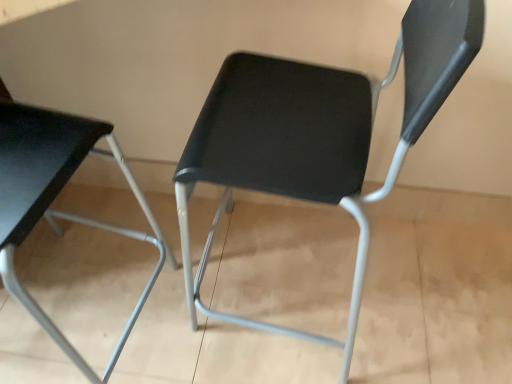
Where is `free region under matte black chair at center, the first chair in the right-to-left sequence (from a real-world perspective)`? Image resolution: width=512 pixels, height=384 pixels. free region under matte black chair at center, the first chair in the right-to-left sequence (from a real-world perspective) is located at coordinates [289, 283].